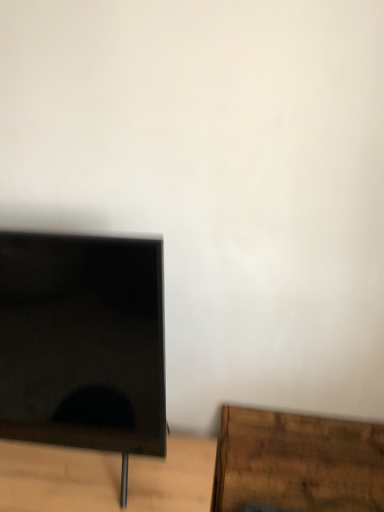
Question: Can you confirm if brown wood table at lower right is bigger than brown wooden table at lower left?

Choices:
 (A) no
 (B) yes

Answer: (A)

Question: Is brown wood table at lower right wider than brown wooden table at lower left?

Choices:
 (A) no
 (B) yes

Answer: (A)

Question: Is brown wood table at lower right beside brown wooden table at lower left?

Choices:
 (A) no
 (B) yes

Answer: (A)

Question: Is brown wood table at lower right not close to brown wooden table at lower left?

Choices:
 (A) no
 (B) yes

Answer: (A)

Question: Does brown wood table at lower right have a lesser width compared to brown wooden table at lower left?

Choices:
 (A) no
 (B) yes

Answer: (B)

Question: Looking at their shapes, would you say brown wood table at lower right is wider or thinner than brown wooden table at lower left?

Choices:
 (A) wide
 (B) thin

Answer: (B)

Question: In the image, is brown wood table at lower right on the left side or the right side of brown wooden table at lower left?

Choices:
 (A) right
 (B) left

Answer: (A)

Question: From the image's perspective, is brown wood table at lower right located above or below brown wooden table at lower left?

Choices:
 (A) above
 (B) below

Answer: (A)

Question: Which is correct: brown wood table at lower right is inside brown wooden table at lower left, or outside of it?

Choices:
 (A) inside
 (B) outside

Answer: (B)

Question: Considering the relative positions of black glossy monitor at left and brown wooden table at lower left in the image provided, is black glossy monitor at left to the left or to the right of brown wooden table at lower left?

Choices:
 (A) right
 (B) left

Answer: (B)

Question: Considering the positions of point coord(11,279) and point coord(66,458), is point coord(11,279) closer or farther from the camera than point coord(66,458)?

Choices:
 (A) farther
 (B) closer

Answer: (B)

Question: Which is correct: black glossy monitor at left is inside brown wooden table at lower left, or outside of it?

Choices:
 (A) inside
 (B) outside

Answer: (B)

Question: From a real-world perspective, is black glossy monitor at left above or below brown wooden table at lower left?

Choices:
 (A) above
 (B) below

Answer: (A)

Question: Based on their positions, is brown wooden table at lower left located to the left or right of brown wood table at lower right?

Choices:
 (A) right
 (B) left

Answer: (B)

Question: Which is correct: brown wooden table at lower left is inside brown wood table at lower right, or outside of it?

Choices:
 (A) outside
 (B) inside

Answer: (A)